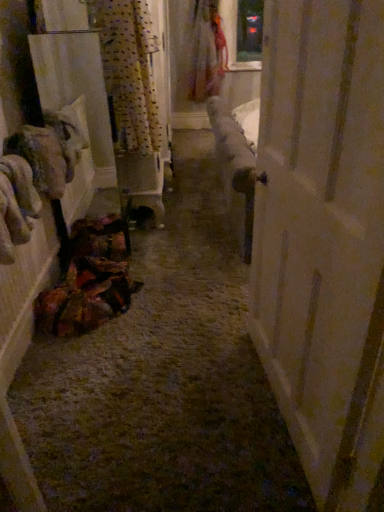
Question: Should I look upward or downward to see floral fabric dress at upper center?

Choices:
 (A) down
 (B) up

Answer: (B)

Question: From a real-world perspective, does patterned fabric curtain at upper left sit lower than white wood door at right?

Choices:
 (A) yes
 (B) no

Answer: (B)

Question: Does patterned fabric curtain at upper left lie behind white wood door at right?

Choices:
 (A) yes
 (B) no

Answer: (A)

Question: Is patterned fabric curtain at upper left positioned in front of white wood door at right?

Choices:
 (A) no
 (B) yes

Answer: (A)

Question: Can you confirm if patterned fabric curtain at upper left is smaller than white wood door at right?

Choices:
 (A) yes
 (B) no

Answer: (A)

Question: Considering the relative positions of patterned fabric curtain at upper left and white wood door at right in the image provided, is patterned fabric curtain at upper left to the right of white wood door at right from the viewer's perspective?

Choices:
 (A) yes
 (B) no

Answer: (B)

Question: From the image's perspective, is patterned fabric curtain at upper left beneath white wood door at right?

Choices:
 (A) yes
 (B) no

Answer: (B)

Question: Can you confirm if floral fabric dress at upper center is wider than white wood door at right?

Choices:
 (A) no
 (B) yes

Answer: (B)

Question: Is floral fabric dress at upper center smaller than white wood door at right?

Choices:
 (A) no
 (B) yes

Answer: (A)

Question: Does floral fabric dress at upper center have a larger size compared to white wood door at right?

Choices:
 (A) no
 (B) yes

Answer: (B)

Question: From a real-world perspective, is floral fabric dress at upper center over white wood door at right?

Choices:
 (A) no
 (B) yes

Answer: (B)

Question: Is floral fabric dress at upper center not close to white wood door at right?

Choices:
 (A) no
 (B) yes

Answer: (B)

Question: Does floral fabric dress at upper center appear on the left side of white wood door at right?

Choices:
 (A) yes
 (B) no

Answer: (A)

Question: Considering the relative positions of white wood door at right and floral fabric dress at upper center in the image provided, is white wood door at right behind floral fabric dress at upper center?

Choices:
 (A) no
 (B) yes

Answer: (A)